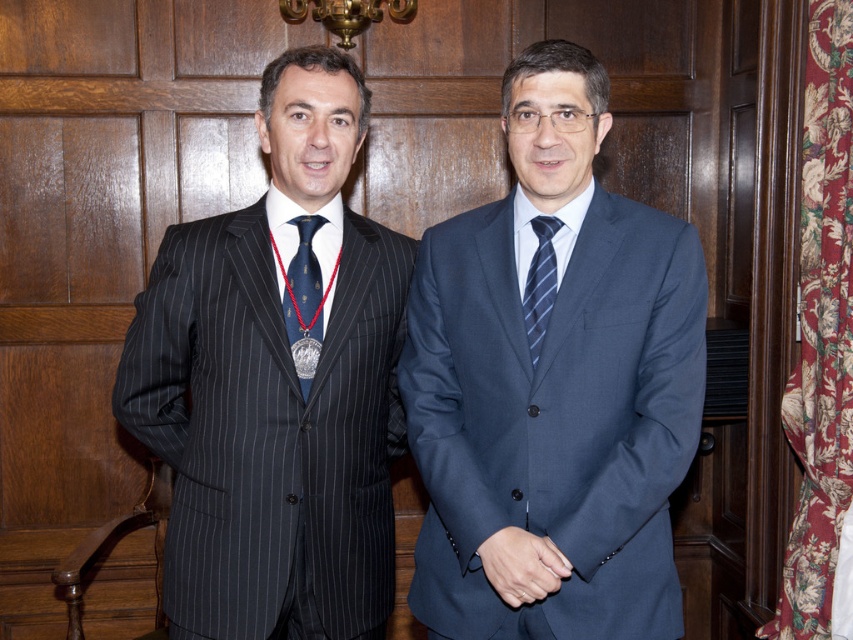
Question: Among these objects, which one is farthest from the camera?

Choices:
 (A) blue striped tie at center
 (B) pinstriped suit at left

Answer: (B)

Question: Which of the following is the closest to the observer?

Choices:
 (A) blue smooth suit at center
 (B) blue silk tie at left

Answer: (A)

Question: Is blue smooth suit at center behind pinstriped suit at left?

Choices:
 (A) no
 (B) yes

Answer: (A)

Question: Is blue silk tie at left smaller than blue striped tie at center?

Choices:
 (A) yes
 (B) no

Answer: (B)

Question: Considering the real-world distances, which object is farthest from the blue silk tie at left?

Choices:
 (A) blue smooth suit at center
 (B) blue striped tie at center
 (C) pinstriped suit at left

Answer: (B)

Question: Is blue smooth suit at center smaller than blue striped tie at center?

Choices:
 (A) yes
 (B) no

Answer: (B)